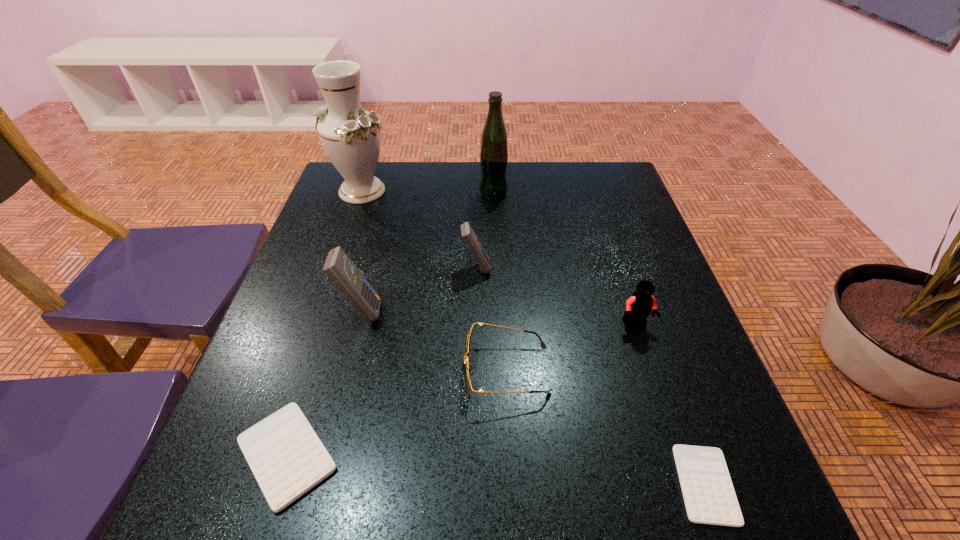
The image size is (960, 540). Find the location of `vacant space located 0.090m on the lenses of the black sunglasses`. vacant space located 0.090m on the lenses of the black sunglasses is located at coordinates (417, 370).

Find the location of a particular element. vacant space positioned 0.390m on the lenses of the black sunglasses is located at coordinates (258, 370).

Find the location of `vacant space located 0.400m on the back of the third tallest calculator`. vacant space located 0.400m on the back of the third tallest calculator is located at coordinates (350, 256).

At what (x,y) coordinates should I click in order to perform the action: click on free space located 0.190m on the back of the right white calculator. Please return your answer as a coordinate pair (x, y). The width and height of the screenshot is (960, 540). Looking at the image, I should click on (659, 353).

At what (x,y) coordinates should I click in order to perform the action: click on vase present at the far edge. Please return your answer as a coordinate pair (x, y). This screenshot has height=540, width=960. Looking at the image, I should click on (351, 138).

In order to click on beer bottle that is at the far edge in this screenshot , I will do `click(494, 145)`.

Where is `vase located at the left edge`? This screenshot has width=960, height=540. vase located at the left edge is located at coordinates (351, 138).

I want to click on Lego at the right edge, so click(x=639, y=305).

This screenshot has width=960, height=540. I want to click on calculator located in the right edge section of the desktop, so click(709, 496).

Where is `object at the far left corner`? object at the far left corner is located at coordinates (351, 138).